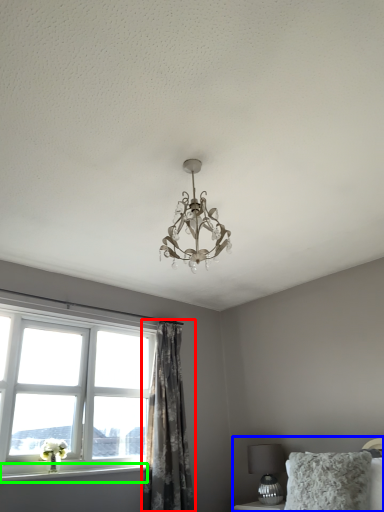
Question: Which object is the closest to the curtain (highlighted by a red box)? Choose among these: bed (highlighted by a blue box) or window sill (highlighted by a green box).

Choices:
 (A) bed
 (B) window sill

Answer: (B)